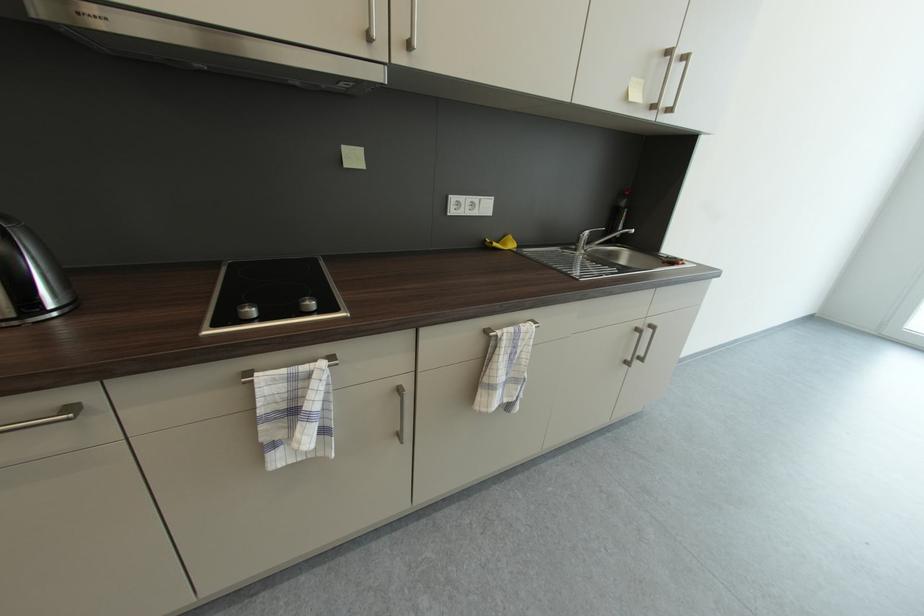
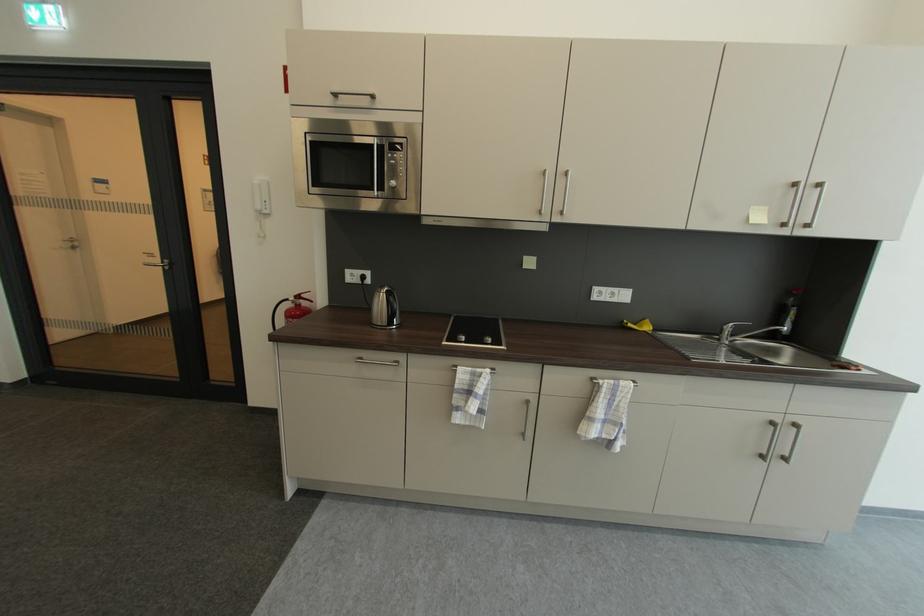
Where in the second image is the point corresponding to point 579,248 from the first image?

(723, 339)